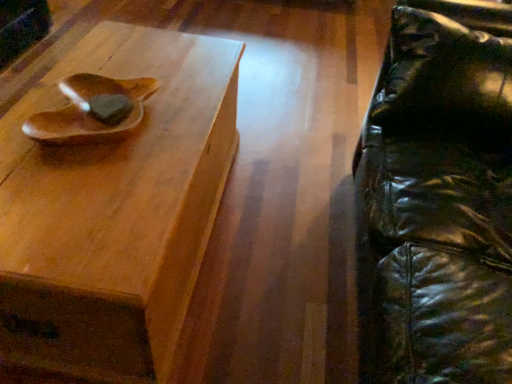
Identify the location of vacant area that is in front of wooden bowl at upper left. (79, 200).